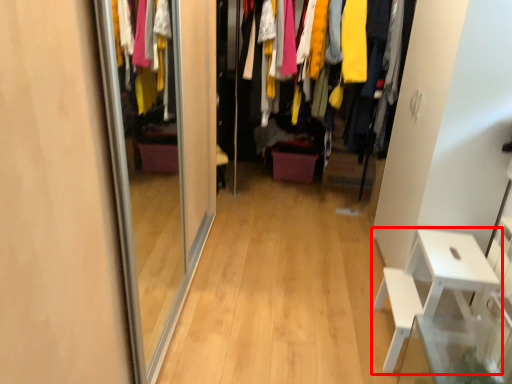
Question: From the image's perspective, considering the relative positions of furniture (annotated by the red box) and closet in the image provided, where is furniture (annotated by the red box) located with respect to the staircase?

Choices:
 (A) above
 (B) below

Answer: (B)